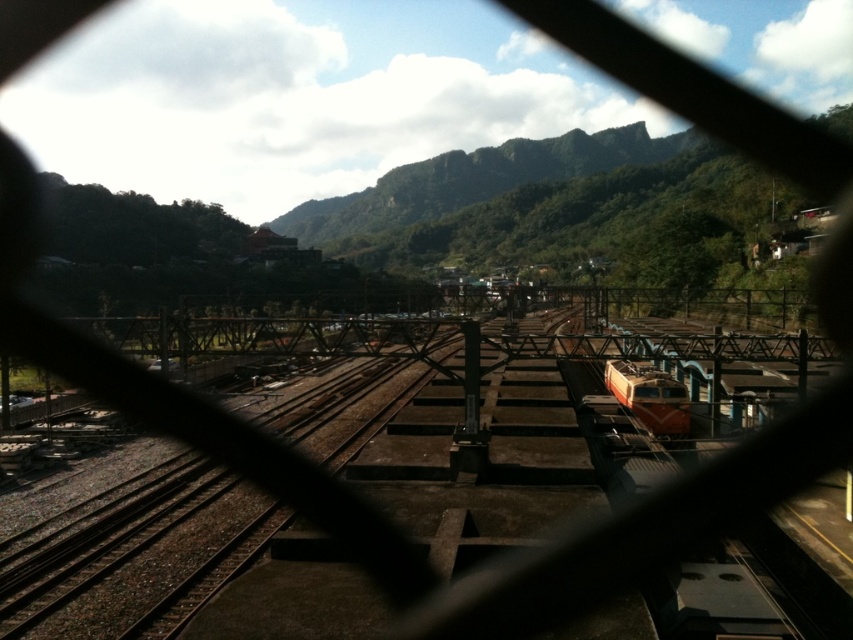
Is point (360, 554) less distant than point (622, 376)?

Yes.

Is rusty metal train track at center smaller than orange metallic train at center?

No.

What are the coordinates of `rusty metal train track at center` in the screenshot? It's located at (241, 456).